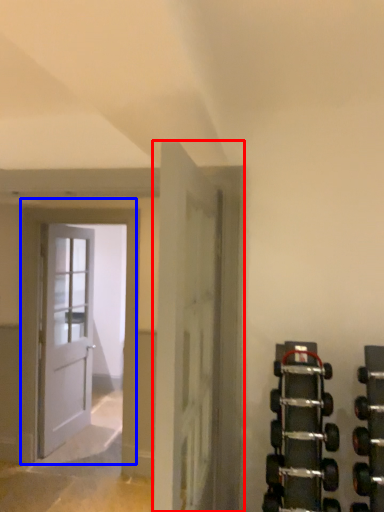
Question: Among these objects, which one is farthest to the camera, door (highlighted by a red box) or door (highlighted by a blue box)?

Choices:
 (A) door
 (B) door

Answer: (B)